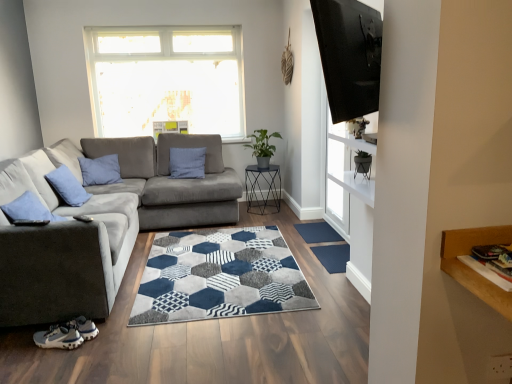
What do you see at coordinates (336, 185) in the screenshot? Image resolution: width=512 pixels, height=384 pixels. I see `transparent glass door at upper right` at bounding box center [336, 185].

In order to face velvet blue pillow at left, should I rotate leftwards or rightwards?

Turn left by 23.513 degrees to look at velvet blue pillow at left.

Locate an element on the screen. velvet blue pillow at left is located at coordinates (67, 186).

The height and width of the screenshot is (384, 512). What do you see at coordinates (349, 56) in the screenshot?
I see `black glossy tv at upper right` at bounding box center [349, 56].

Describe the element at coordinates (263, 189) in the screenshot. I see `metallic hexagonal table at center` at that location.

Describe the element at coordinates (362, 165) in the screenshot. I see `black matte plant pot at upper center` at that location.

Locate an element on the screen. black matte plant pot at upper center is located at coordinates (362, 165).

The height and width of the screenshot is (384, 512). I want to click on gray fabric couch at left, so [101, 223].

Is blue textured doormat at center, which is the 2th doormat in back-to-front order, taller than blue rubber doormat at center, arranged as the first doormat when viewed from the back?

Yes, blue textured doormat at center, which is the 2th doormat in back-to-front order, is taller than blue rubber doormat at center, arranged as the first doormat when viewed from the back.

Does blue textured doormat at center, which is the 2th doormat in back-to-front order, have a greater width compared to blue rubber doormat at center, arranged as the first doormat when viewed from the back?

Indeed, blue textured doormat at center, which is the 2th doormat in back-to-front order, has a greater width compared to blue rubber doormat at center, arranged as the first doormat when viewed from the back.

Is blue textured doormat at center, which is the 2th doormat in back-to-front order, facing away from blue rubber doormat at center, arranged as the 2th doormat when viewed from the front?

No.

From a real-world perspective, which is physically below, blue textured doormat at center, placed as the second doormat when sorted from top to bottom, or blue rubber doormat at center, arranged as the first doormat when viewed from the back?

From a 3D spatial view, blue rubber doormat at center, arranged as the first doormat when viewed from the back, is below.

Considering the relative positions of transparent glass door at upper right and metallic hexagonal table at center in the image provided, is transparent glass door at upper right to the left of metallic hexagonal table at center from the viewer's perspective?

Incorrect, transparent glass door at upper right is not on the left side of metallic hexagonal table at center.

From a real-world perspective, is transparent glass door at upper right on metallic hexagonal table at center?

Yes.

From the image's perspective, is transparent glass door at upper right located above metallic hexagonal table at center?

Correct, transparent glass door at upper right appears higher than metallic hexagonal table at center in the image.

From the image's perspective, relative to transparent glass door at upper right, is black glossy tv at upper right above or below?

Clearly, from the image's perspective, black glossy tv at upper right is above transparent glass door at upper right.

Considering the relative positions of black glossy tv at upper right and transparent glass door at upper right in the image provided, is black glossy tv at upper right to the right of transparent glass door at upper right from the viewer's perspective?

In fact, black glossy tv at upper right is to the left of transparent glass door at upper right.

Would you say black glossy tv at upper right contains transparent glass door at upper right?

No, black glossy tv at upper right does not contain transparent glass door at upper right.

Are black glossy tv at upper right and transparent glass door at upper right beside each other?

black glossy tv at upper right and transparent glass door at upper right are not in contact.

Is point (368, 179) farther from camera compared to point (213, 168)?

No, it is not.

Is black matte plant pot at upper center taller than gray fabric couch at left?

No.

Is gray fabric couch at left inside black matte plant pot at upper center?

No, gray fabric couch at left is not a part of black matte plant pot at upper center.

Image resolution: width=512 pixels, height=384 pixels. I want to click on studio couch that is on the left side of black matte plant pot at upper center, so click(x=101, y=223).

Who is taller, transparent glass door at upper right or gray fabric couch at left?

transparent glass door at upper right.

Is transparent glass door at upper right smaller than gray fabric couch at left?

Yes, transparent glass door at upper right is smaller than gray fabric couch at left.

This screenshot has height=384, width=512. I want to click on studio couch that appears below the transparent glass door at upper right (from the image's perspective), so click(101, 223).

Is transparent glass door at upper right placed right next to gray fabric couch at left?

No, transparent glass door at upper right is not in contact with gray fabric couch at left.

From the image's perspective, between blue rubber doormat at center, arranged as the first doormat when viewed from the back, and black matte plant pot at upper center, which one is located above?

black matte plant pot at upper center.

How different are the orientations of blue rubber doormat at center, arranged as the first doormat when viewed from the back, and black matte plant pot at upper center in degrees?

The angle between the facing direction of blue rubber doormat at center, arranged as the first doormat when viewed from the back, and the facing direction of black matte plant pot at upper center is 179 degrees.

Consider the image. From a real-world perspective, relative to black matte plant pot at upper center, is blue rubber doormat at center, acting as the 2th doormat starting from the bottom, vertically above or below?

blue rubber doormat at center, acting as the 2th doormat starting from the bottom, is below black matte plant pot at upper center.

Does blue rubber doormat at center, arranged as the first doormat when viewed from the back, touch black matte plant pot at upper center?

blue rubber doormat at center, arranged as the first doormat when viewed from the back, and black matte plant pot at upper center are not in contact.

From the picture: Could gray fabric couch at left be considered to be inside blue rubber doormat at center, the 1th doormat viewed from the top?

No, gray fabric couch at left is not surrounded by blue rubber doormat at center, the 1th doormat viewed from the top.

From the image's perspective, which is above, blue rubber doormat at center, the 1th doormat viewed from the top, or gray fabric couch at left?

From the image's view, gray fabric couch at left is above.

Which point is more forward, (315,222) or (22,265)?

The point (22,265) is in front.

Considering the sizes of objects blue rubber doormat at center, arranged as the 2th doormat when viewed from the front, and gray fabric couch at left in the image provided, who is bigger, blue rubber doormat at center, arranged as the 2th doormat when viewed from the front, or gray fabric couch at left?

gray fabric couch at left is bigger.

The height and width of the screenshot is (384, 512). I want to click on doormat to the left of blue textured doormat at center, the first doormat ordered from the bottom, so click(317, 232).

Locate an element on the screen. The image size is (512, 384). table behind the transparent glass door at upper right is located at coordinates (263, 189).

Estimate the real-world distances between objects in this image. Which object is closer to velvet blue pillow at left, black matte plant pot at upper center or metallic hexagonal table at center?

metallic hexagonal table at center.

Which object lies nearer to the anchor point transparent glass door at upper right, gray fabric couch at left or black glossy tv at upper right?

Among the two, gray fabric couch at left is located nearer to transparent glass door at upper right.

When comparing their distances from black glossy tv at upper right, does blue textured doormat at center, the first doormat ordered from the bottom, or transparent glass door at upper right seem further?

transparent glass door at upper right is further to black glossy tv at upper right.

Which object lies further to the anchor point blue rubber doormat at center, the 1th doormat viewed from the top, velvet blue pillow at left or black glossy tv at upper right?

black glossy tv at upper right lies further to blue rubber doormat at center, the 1th doormat viewed from the top, than the other object.

When comparing their distances from blue textured doormat at center, the first doormat ordered from the bottom, does transparent glass door at upper right or black glossy tv at upper right seem closer?

transparent glass door at upper right is positioned closer to the anchor blue textured doormat at center, the first doormat ordered from the bottom.

Looking at the image, which one is located further to blue rubber doormat at center, the 1th doormat viewed from the top, black glossy tv at upper right or black matte plant pot at upper center?

black glossy tv at upper right is further to blue rubber doormat at center, the 1th doormat viewed from the top.

When comparing their distances from gray fabric couch at left, does black matte plant pot at upper center or black glossy tv at upper right seem further?

Based on the image, black glossy tv at upper right appears to be further to gray fabric couch at left.

Looking at the image, which one is located further to black glossy tv at upper right, black matte plant pot at upper center or blue rubber doormat at center, acting as the 2th doormat starting from the bottom?

blue rubber doormat at center, acting as the 2th doormat starting from the bottom.

You are a GUI agent. You are given a task and a screenshot of the screen. Output one action in this format:
    pyautogui.click(x=<x>, y=<y>)
    Task: Click on the window screen situated between velvet blue pillow at left and black matte plant pot at upper center from left to right
    This screenshot has width=512, height=384.
    Given the screenshot: What is the action you would take?
    pyautogui.click(x=349, y=56)

Locate an element on the screen. The height and width of the screenshot is (384, 512). doormat between black matte plant pot at upper center and transparent glass door at upper right in the front-back direction is located at coordinates (333, 257).

The width and height of the screenshot is (512, 384). I want to click on doormat between blue textured doormat at center, the first doormat ordered from the bottom, and metallic hexagonal table at center, along the z-axis, so click(x=317, y=232).

Where is `chair between black glossy tv at upper right and blue textured doormat at center, acting as the first doormat starting from the front, along the z-axis`? chair between black glossy tv at upper right and blue textured doormat at center, acting as the first doormat starting from the front, along the z-axis is located at coordinates (362, 165).